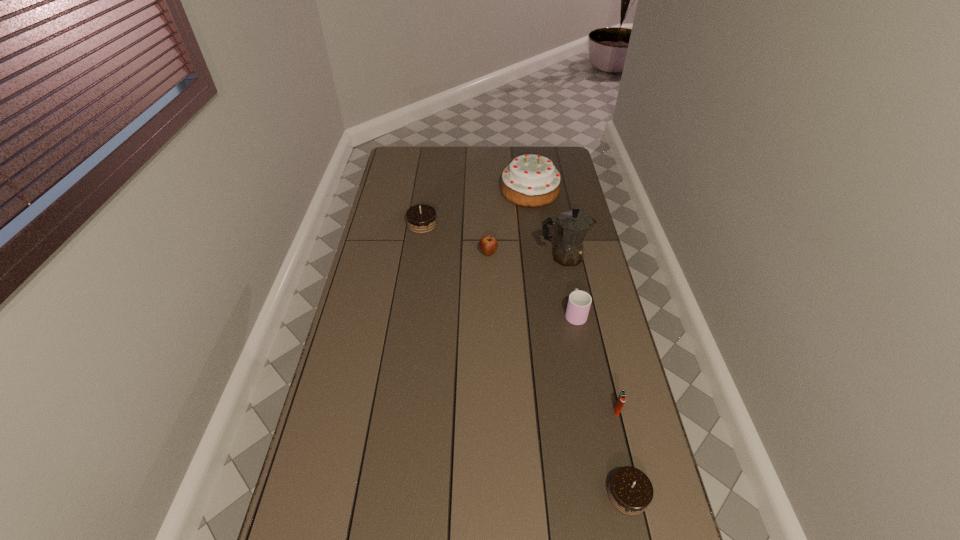
Identify the location of free region that satisfies the following two spatial constraints: 1. on the pouring side of the sixth farthest object; 2. on the right side of the tallest object. (594, 411).

The image size is (960, 540). Identify the location of vacant point that satisfies the following two spatial constraints: 1. on the front side of the igniter; 2. on the right side of the second object from left to right. (492, 411).

Find the location of a particular element. The image size is (960, 540). free space that satisfies the following two spatial constraints: 1. on the back side of the apple; 2. on the right side of the cake is located at coordinates (487, 191).